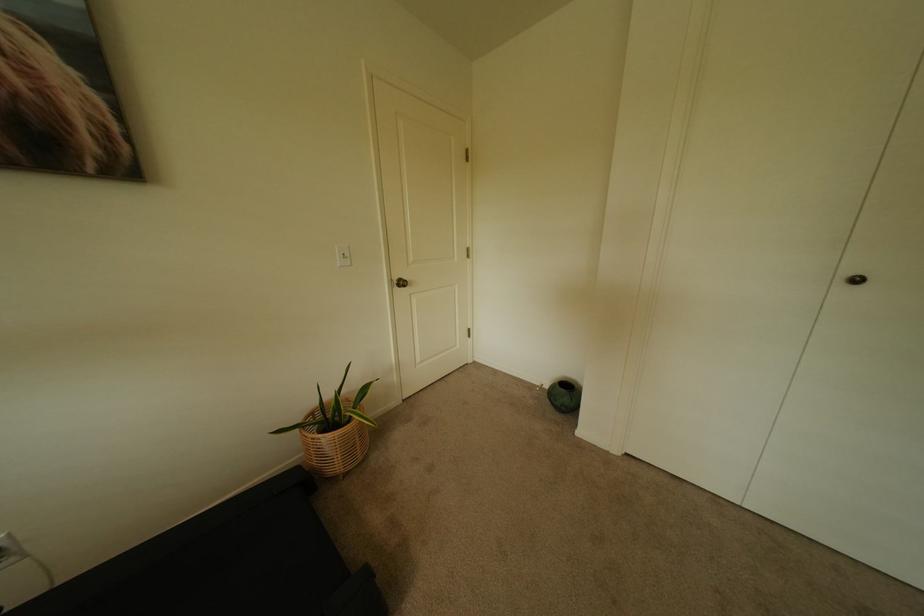
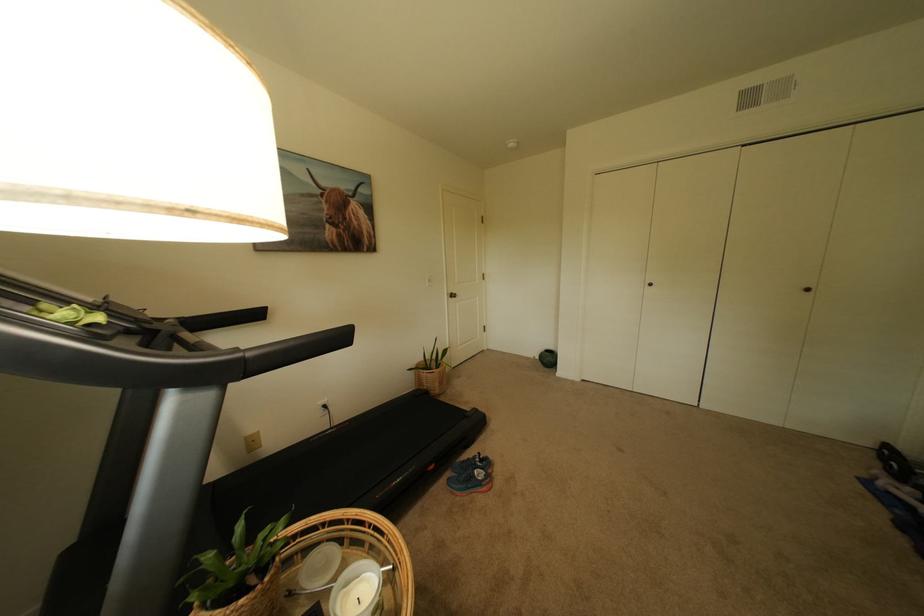
What movement of the cameraman would produce the second image?

The cameraman walked toward left, backward.